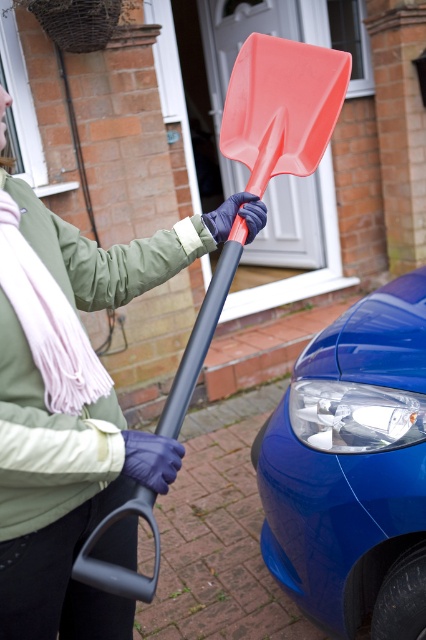
You are a delivery person who needs to park your delivery van behind the glossy blue car at lower right. Can you safely maneuver your van into the space behind it without hitting the rubberized plastic shovel at center?

The glossy blue car at lower right is further to the viewer than the rubberized plastic shovel at center, meaning the shovel is closer to you. To park behind the car, you must first navigate around or past the shovel, which may pose a risk of collision. Therefore, it might not be safe to maneuver the van into that space without hitting the rubberized plastic shovel at center.